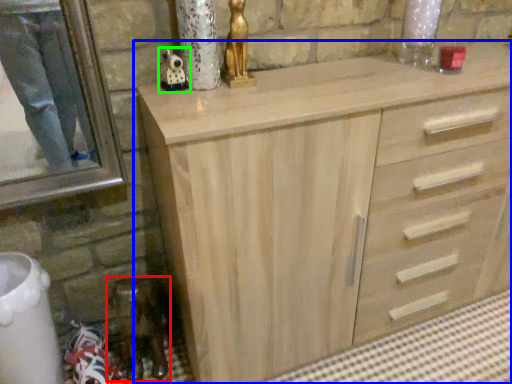
Question: Which is nearer to the miniature (highlighted by a red box)? chest of drawers (highlighted by a blue box) or miniature (highlighted by a green box).

Choices:
 (A) chest of drawers
 (B) miniature

Answer: (A)